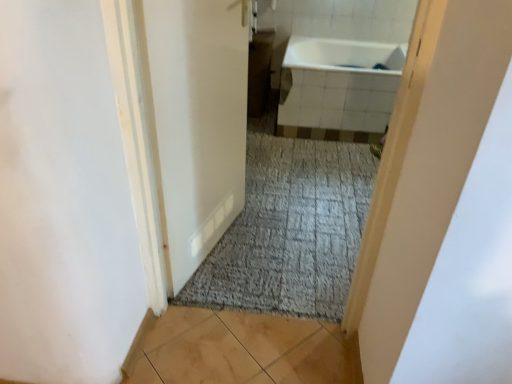
Question: From the image's perspective, is white glossy bathtub at upper center positioned above or below white glossy door at center?

Choices:
 (A) below
 (B) above

Answer: (B)

Question: Is white glossy bathtub at upper center bigger or smaller than white glossy door at center?

Choices:
 (A) big
 (B) small

Answer: (A)

Question: Estimate the real-world distances between objects in this image. Which object is closer to the white glossy door at center?

Choices:
 (A) light brown tile at lower center
 (B) white glossy bathtub at upper center

Answer: (A)

Question: Which object is positioned closest to the light brown tile at lower center?

Choices:
 (A) white glossy door at center
 (B) white glossy bathtub at upper center

Answer: (A)